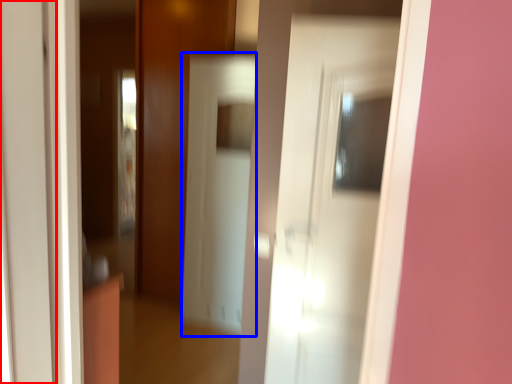
Question: Among these objects, which one is nearest to the camera, door (highlighted by a red box) or screen door (highlighted by a blue box)?

Choices:
 (A) door
 (B) screen door

Answer: (A)